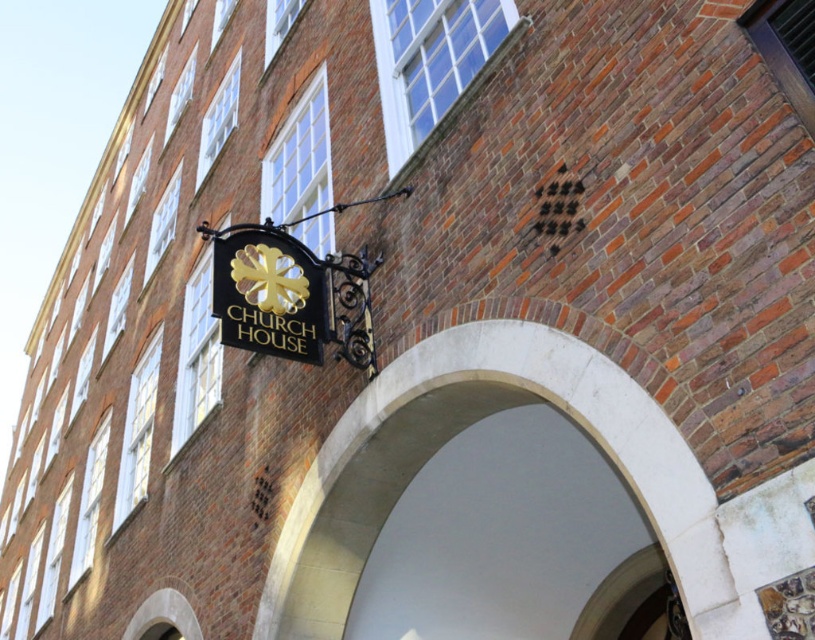
Describe the element at coordinates (457, 433) in the screenshot. I see `white stone arch at center` at that location.

Looking at this image, who is taller, white stone arch at center or gold metallic sign at center?

Standing taller between the two is white stone arch at center.

The height and width of the screenshot is (640, 815). I want to click on white stone arch at center, so click(x=457, y=433).